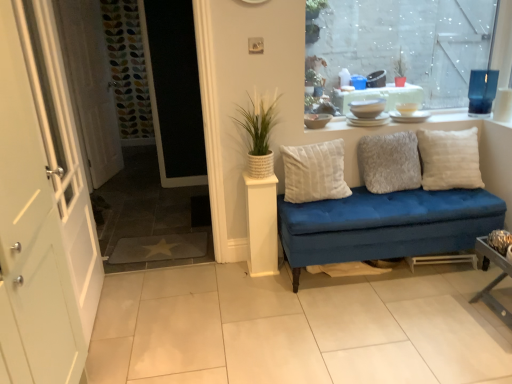
Question: Looking at their shapes, would you say white textured door at left is wider or thinner than white cotton cushion at center, the 3th pillow viewed from the right?

Choices:
 (A) wide
 (B) thin

Answer: (A)

Question: Relative to white cotton cushion at center, marked as the first pillow in a left-to-right arrangement, is white textured door at left in front or behind?

Choices:
 (A) behind
 (B) front

Answer: (B)

Question: Estimate the real-world distances between objects in this image. Which object is closer to the white cotton cushion at center, marked as the first pillow in a left-to-right arrangement?

Choices:
 (A) white textured door at left
 (B) transparent glass window at upper right
 (C) white soft cushion at right, marked as the first pillow in a right-to-left arrangement
 (D) textured gray pillow at center, which is the 2th pillow from right to left
 (E) white ceramic dishes at upper center

Answer: (D)

Question: Based on their relative distances, which object is nearer to the white textured screen door at left?

Choices:
 (A) white textured door at left
 (B) white textured pot at center
 (C) white painted wood door at left
 (D) white ceramic dishes at upper center
 (E) textured gray pillow at center, the second pillow when ordered from left to right

Answer: (A)